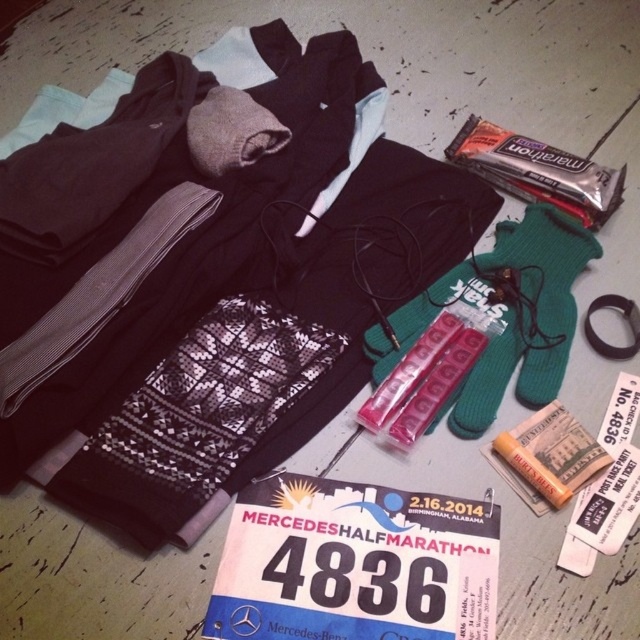
You are organizing a marathon participant kit and need to place the pink plastic blister pack at center and orange matte lip balm at center into a small pouch. Which item should you place first to ensure both fit properly?

The orange matte lip balm at center should be placed first because the pink plastic blister pack at center is larger and needs more space. Placing the larger item first might leave insufficient room for the smaller one.

Based on the scene description, where is the pink plastic blister pack at center located in terms of coordinates?

The pink plastic blister pack at center is located at coordinates point (435, 387).

You are organizing a runner kit for a marathon and have to place the pink plastic pill case at center and orange matte lip balm at center. Which item is closer to you when both are placed on the table?

The pink plastic pill case at center is closer to you because it is further to the viewer than the orange matte lip balm at center.